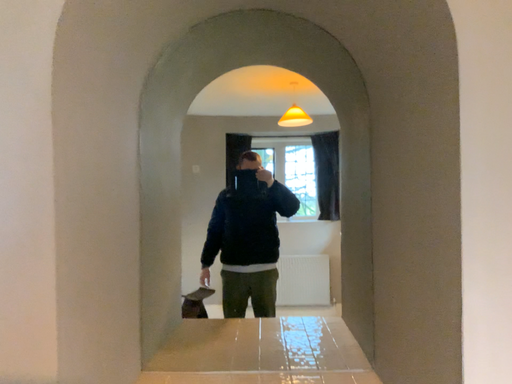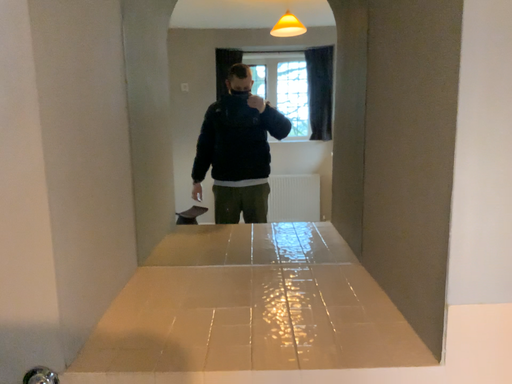
Question: Which way did the camera rotate in the video?

Choices:
 (A) rotated upward
 (B) rotated downward

Answer: (B)